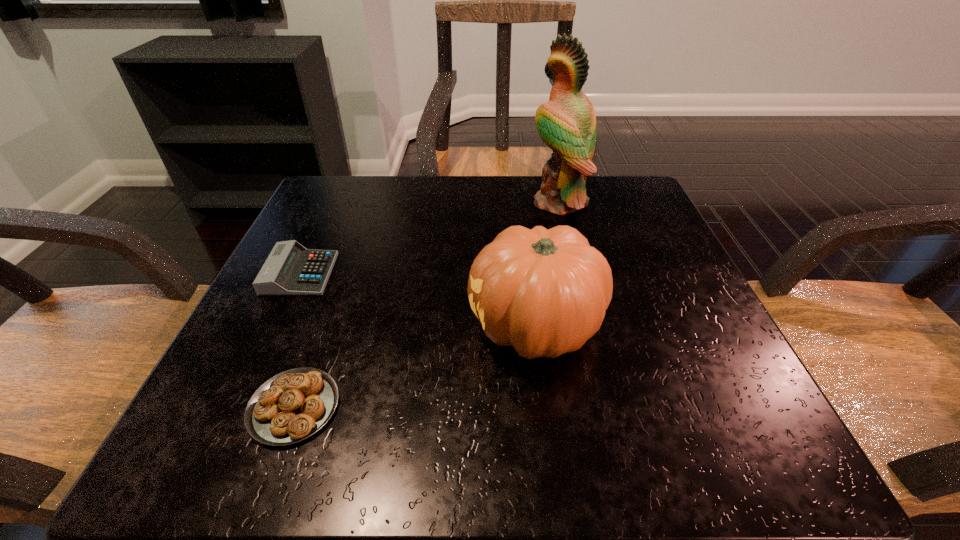
The width and height of the screenshot is (960, 540). Identify the location of free spot located on the carved face of the pumpkin. (256, 327).

The width and height of the screenshot is (960, 540). Find the location of `blank space located on the back of the calculator`. blank space located on the back of the calculator is located at coordinates (332, 205).

Where is `free spot located on the right of the pastry`? free spot located on the right of the pastry is located at coordinates (543, 407).

Image resolution: width=960 pixels, height=540 pixels. Find the location of `object that is at the far edge`. object that is at the far edge is located at coordinates (567, 123).

Where is `object positioned at the near edge`? This screenshot has width=960, height=540. object positioned at the near edge is located at coordinates (293, 405).

Where is `calculator that is at the left edge`? The image size is (960, 540). calculator that is at the left edge is located at coordinates (290, 269).

The image size is (960, 540). In order to click on pastry situated at the left edge in this screenshot , I will do `click(293, 405)`.

In order to click on object that is at the right edge in this screenshot , I will do `click(567, 123)`.

At what (x,y) coordinates should I click in order to perform the action: click on object at the near left corner. Please return your answer as a coordinate pair (x, y). Looking at the image, I should click on (293, 405).

At what (x,y) coordinates should I click in order to perform the action: click on object located in the far right corner section of the desktop. Please return your answer as a coordinate pair (x, y). Looking at the image, I should click on (567, 123).